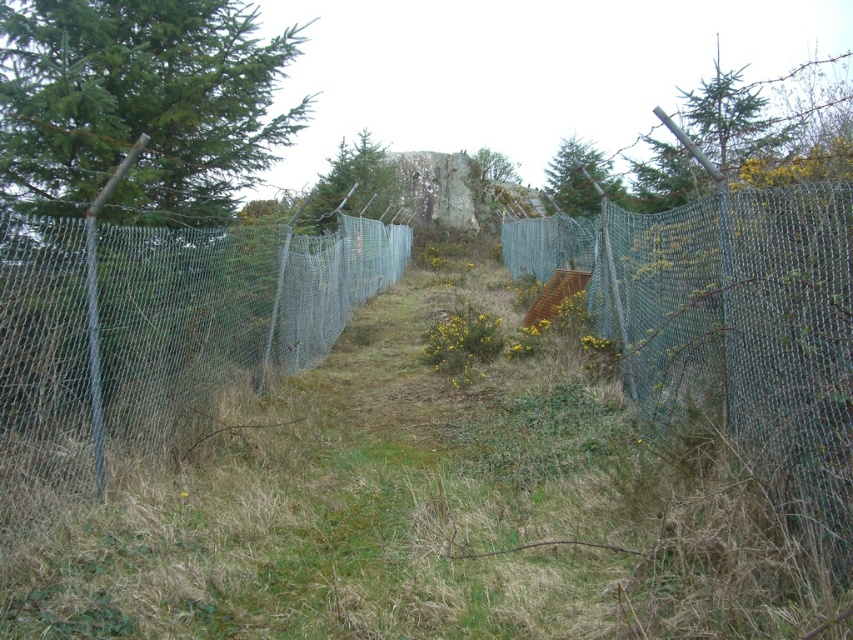
You are a hiker carrying a 10 meter long rope. You want to tie both the green leafy tree at left and the green textured tree at upper center together. Is the rope long enough?

The distance between the green leafy tree at left and the green textured tree at upper center is 11.39 meters. Since the rope is only 10 meters long, it is not long enough to reach between them.

You are standing at the entrance of the fenced pathway and want to walk towards the rocky outcrop. Which tree, the green leafy tree at left or the green textured tree at upper center, is closer to you?

The green textured tree at upper center is closer to you because the green leafy tree at left is located above it, meaning it is positioned further away along the path.